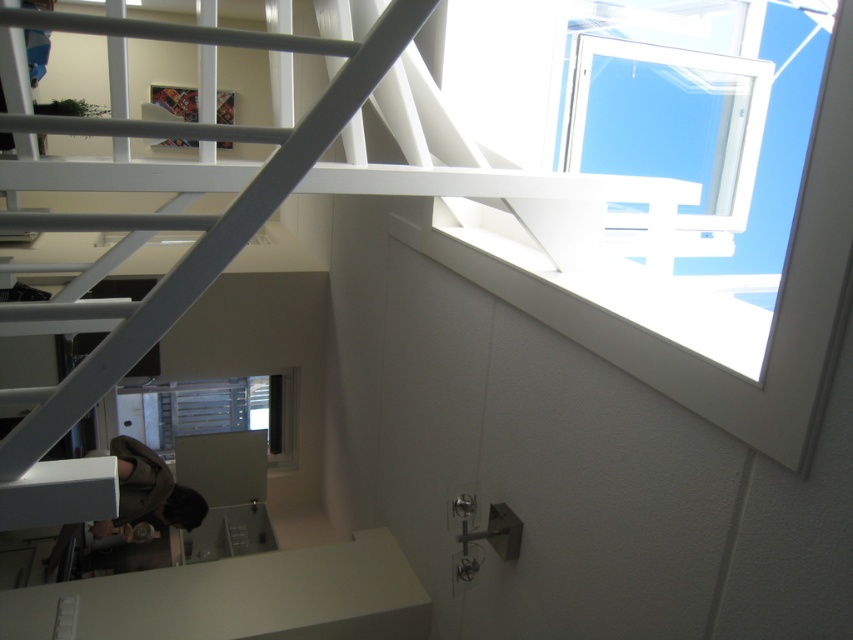
You are standing at the base of the staircase and want to take a photo of the two points mentioned. Which point, point (x=697, y=212) or point (x=288, y=412), will appear larger in your camera view?

Point (x=697, y=212) will appear larger in the camera view because it is closer to the camera than point (x=288, y=412).

You are standing at the bottom of the staircase with a white metal railing and looking up. There is a point marked at coordinates (x=666, y=140). What object is located at that point?

The point at coordinates (x=666, y=140) indicates the transparent glass window at upper right.

You are an interior designer planning to install a new light fixture. You have two options. One is a large chandelier that requires a space of at least 1.5 meters in width. The other is a smaller pendant light that needs 1 meter. Looking at the transparent glass window at upper right and the clear glass window at center, which window would be suitable for each fixture based on their sizes?

The transparent glass window at upper right is larger in size than the clear glass window at center. Therefore, the large chandelier requiring 1.5 meters would fit better at the transparent glass window at upper right, while the smaller pendant light needing 1 meter would be suitable for the clear glass window at center.